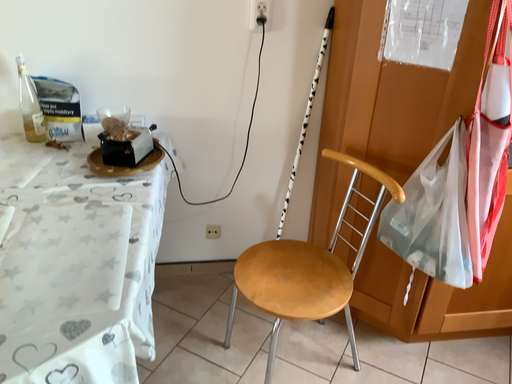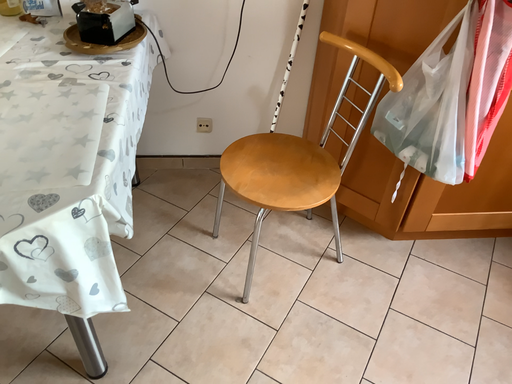
Question: How did the camera likely rotate when shooting the video?

Choices:
 (A) rotated upward
 (B) rotated downward

Answer: (B)